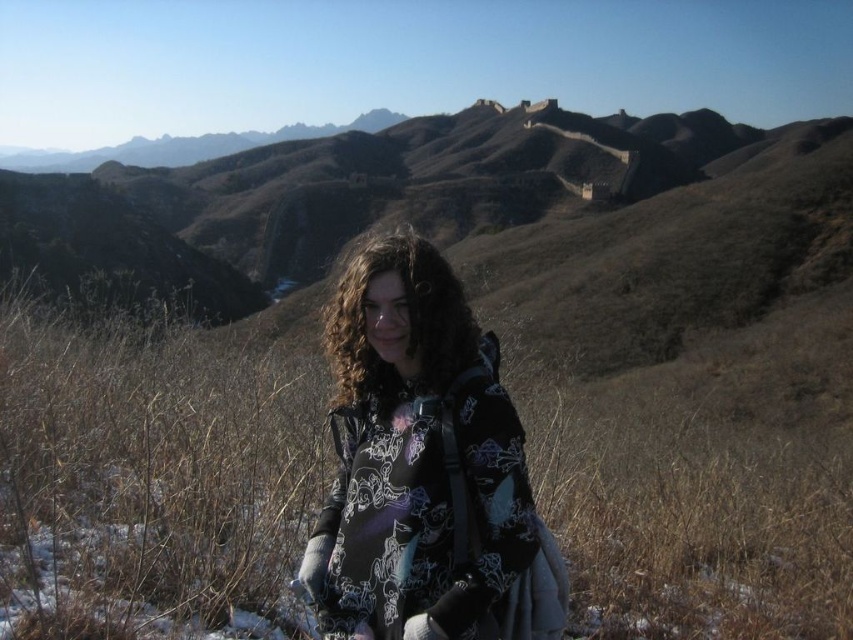
You are a photographer trying to capture a clear shot of the black printed hoodie at center. However, the brown dry grass at center is blocking your view. Can you adjust your camera angle to see the hoodie without the grass in the foreground?

The brown dry grass at center is located above the black printed hoodie at center, so adjusting the camera angle downward might allow you to see the hoodie without the grass blocking the view.

From the picture: You are a photographer trying to capture a closeup of the black printed hoodie at center. However, the brown dry grass at center is blocking the view. Can you estimate if the grass is wider than the hoodie?

The brown dry grass at center might be wider than black printed hoodie at center, so there is a possibility that the grass is blocking the view of the hoodie.